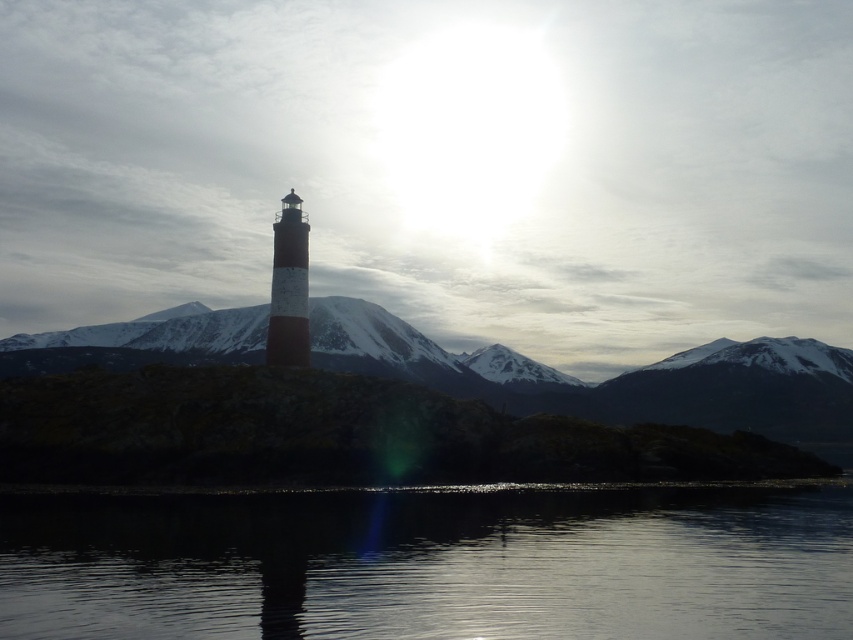
You are standing at the lighthouse and want to take a photo of two points in the scene. The first point is at coordinates point (546, 490) and the second is at point (288, 346). Which point will appear larger in your photo?

Answer: Point (546, 490) will appear larger in the photo because it is closer to the camera than point (288, 346).

You are a bird flying over the scene. You see the transparent glass water at center and the white painted metal lighthouse at center. Which object is located lower in the scene?

The transparent glass water at center is located below the white painted metal lighthouse at center, so it is lower in the scene.

Looking at this image, you are a bird flying over the scene and want to land on the white painted metal lighthouse at center. From your current position above the transparent glass water at center, which direction should you fly to reach the lighthouse?

The transparent glass water at center is closer to the viewer than the white painted metal lighthouse at center, so you should fly towards the lighthouse by moving away from the viewer since it is further back in the scene.